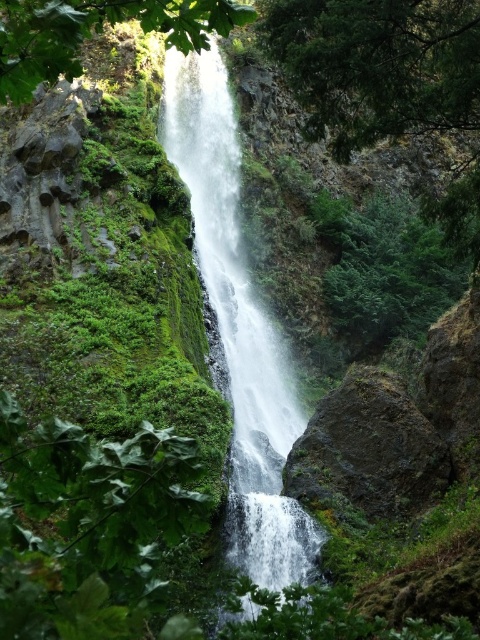
Between point (276, 342) and point (383, 99), which one is positioned in front?

Positioned in front is point (383, 99).

From the picture: Does white frothy water at center appear on the left side of green leafy tree at upper right?

Correct, you'll find white frothy water at center to the left of green leafy tree at upper right.

Is point (192, 170) behind point (348, 54)?

Yes, point (192, 170) is farther from viewer.

Locate an element on the screen. The height and width of the screenshot is (640, 480). white frothy water at center is located at coordinates (239, 326).

Is point (336, 90) positioned after point (182, 1)?

Yes, point (336, 90) is behind point (182, 1).

Is green leafy tree at upper right bigger than green leafy tree at upper center?

Indeed, green leafy tree at upper right has a larger size compared to green leafy tree at upper center.

The height and width of the screenshot is (640, 480). What are the coordinates of `green leafy tree at upper right` in the screenshot? It's located at (377, 65).

Can you confirm if white frothy water at center is positioned above green leafy tree at upper center?

Indeed, white frothy water at center is positioned over green leafy tree at upper center.

Who is more distant from viewer, (x=261, y=572) or (x=45, y=51)?

Point (x=261, y=572)

This screenshot has height=640, width=480. What do you see at coordinates (239, 326) in the screenshot?
I see `white frothy water at center` at bounding box center [239, 326].

Locate an element on the screen. The width and height of the screenshot is (480, 640). white frothy water at center is located at coordinates (239, 326).